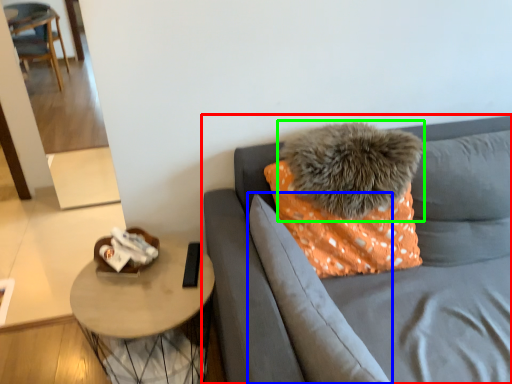
Question: Estimate the real-world distances between objects in this image. Which object is farther from studio couch (highlighted by a red box), pillow (highlighted by a blue box) or pillow (highlighted by a green box)?

Choices:
 (A) pillow
 (B) pillow

Answer: (B)